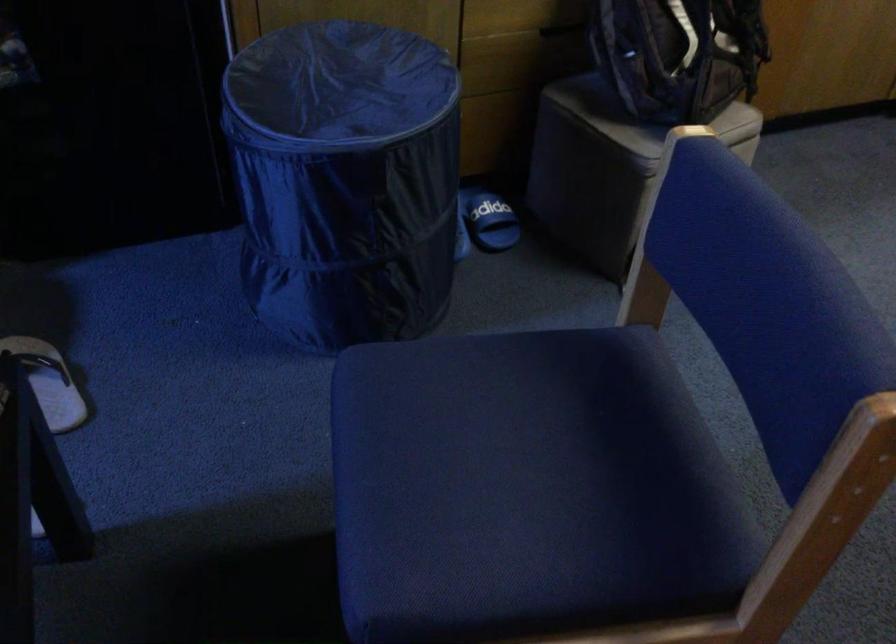
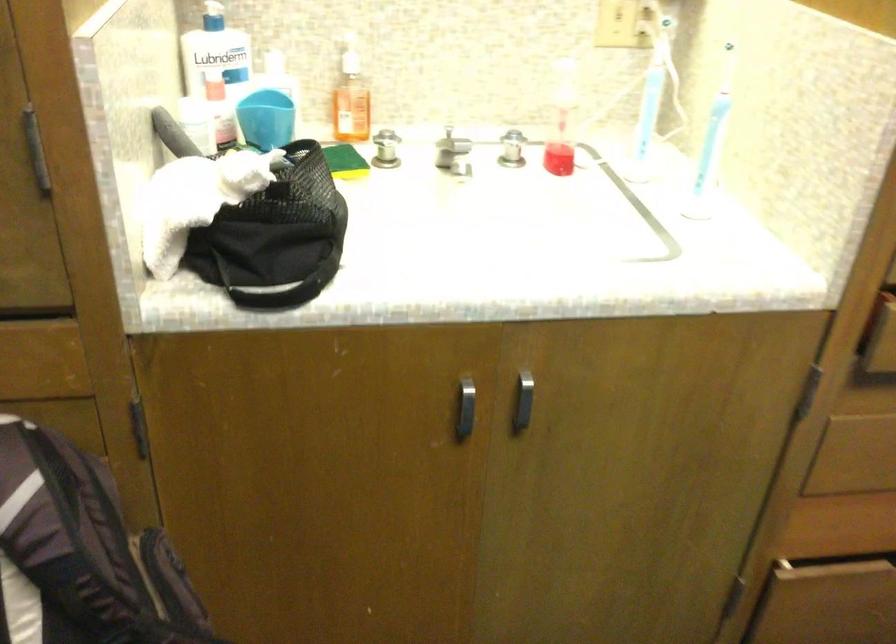
The images are taken continuously from a first-person perspective. In which direction are you moving?

The cameraman walked toward right, forward.